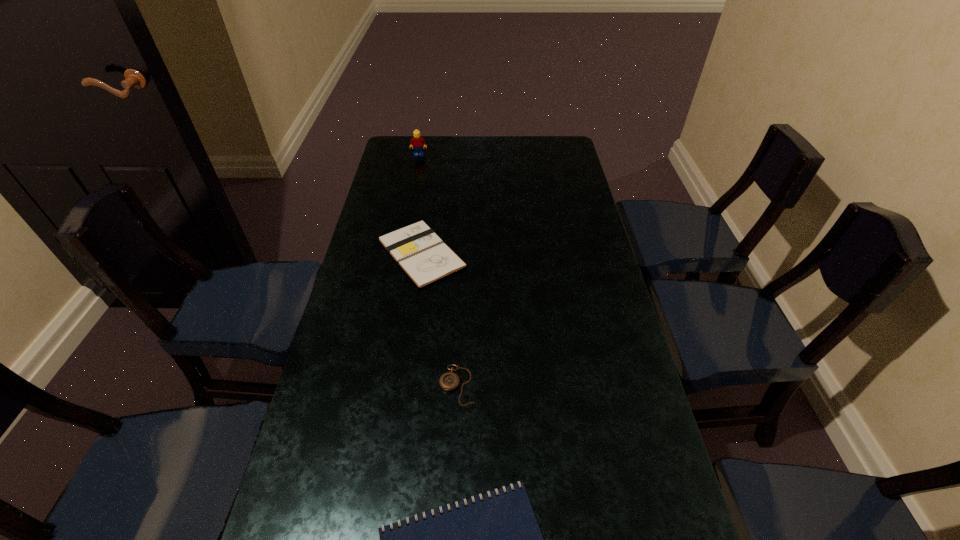
Image resolution: width=960 pixels, height=540 pixels. What are the coordinates of `the farthest object` in the screenshot? It's located at (417, 141).

Where is `the tallest object`? Image resolution: width=960 pixels, height=540 pixels. the tallest object is located at coordinates (417, 141).

The width and height of the screenshot is (960, 540). In order to click on the farther notepad in this screenshot , I will do `click(424, 257)`.

You are a GUI agent. You are given a task and a screenshot of the screen. Output one action in this format:
    pyautogui.click(x=<x>, y=<y>)
    Task: Click on the taller notepad
    This screenshot has height=540, width=960.
    Given the screenshot: What is the action you would take?
    pyautogui.click(x=424, y=257)

You are a GUI agent. You are given a task and a screenshot of the screen. Output one action in this format:
    pyautogui.click(x=<x>, y=<y>)
    Task: Click on the pocket watch
    Image resolution: width=960 pixels, height=540 pixels.
    Given the screenshot: What is the action you would take?
    pyautogui.click(x=449, y=381)

Locate an element on the screen. vacant space situated on the front-facing side of the Lego is located at coordinates (414, 182).

Where is `vacant space located 0.090m on the front of the second farthest object`? The height and width of the screenshot is (540, 960). vacant space located 0.090m on the front of the second farthest object is located at coordinates (413, 314).

Find the location of a particular element. The width and height of the screenshot is (960, 540). vacant region located on the front of the third farthest object is located at coordinates (450, 531).

Find the location of a particular element. object situated at the far edge is located at coordinates (417, 141).

Where is `Lego located in the left edge section of the desktop`? The height and width of the screenshot is (540, 960). Lego located in the left edge section of the desktop is located at coordinates (417, 141).